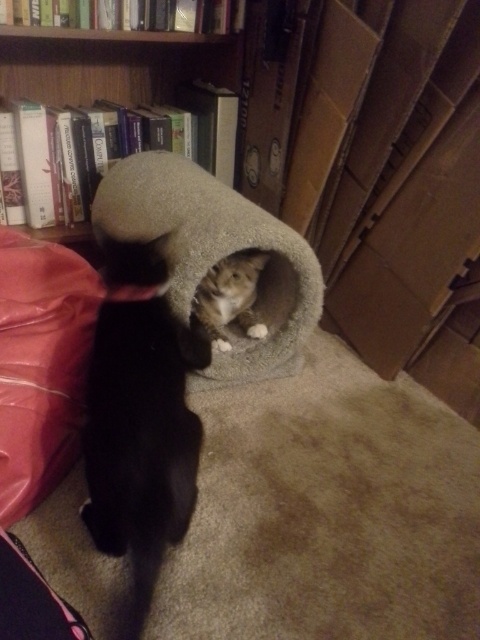
Question: Can you confirm if soft gray carpeted cat bed at center is positioned to the left of velvet pink pillow at lower left?

Choices:
 (A) yes
 (B) no

Answer: (B)

Question: Which point is closer to the camera taking this photo?

Choices:
 (A) (216, 77)
 (B) (183, 504)
 (C) (285, 224)
 (D) (204, 275)

Answer: (B)

Question: Which object is the closest to the fluffy gray cat at center?

Choices:
 (A) soft gray carpeted cat bed at center
 (B) wooden bookshelf at upper left
 (C) velvet pink pillow at lower left
 (D) tabby fur cat at center

Answer: (C)

Question: Can you confirm if fluffy gray cat at center is thinner than tabby fur cat at center?

Choices:
 (A) no
 (B) yes

Answer: (A)

Question: Is fluffy gray cat at center in front of wooden bookshelf at upper left?

Choices:
 (A) no
 (B) yes

Answer: (B)

Question: Which point is farther to the camera?

Choices:
 (A) (291, 292)
 (B) (60, 282)

Answer: (A)